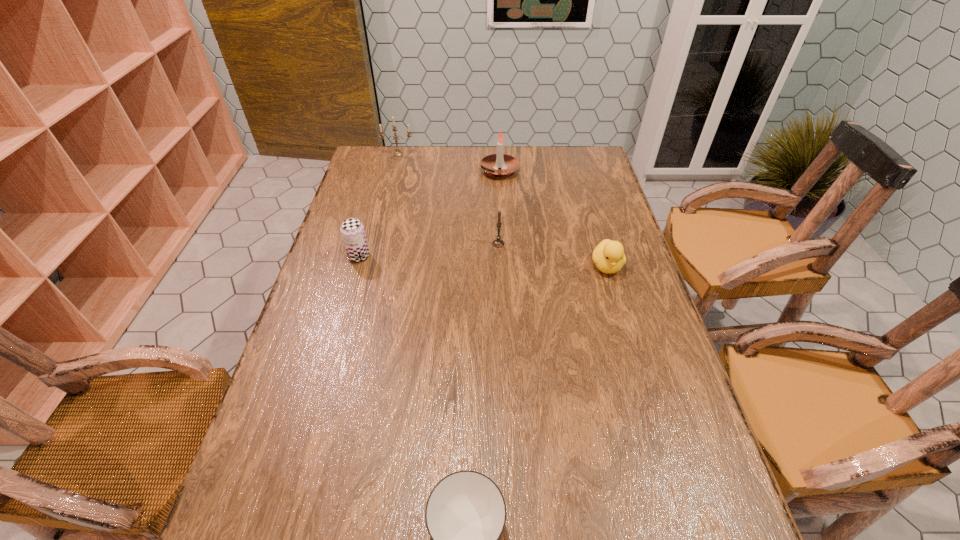
Find the location of a particular element. This screenshot has width=960, height=540. the second farthest object is located at coordinates (490, 164).

Where is `the farthest candle`? The image size is (960, 540). the farthest candle is located at coordinates (397, 153).

Locate an element on the screen. This screenshot has width=960, height=540. the leftmost candle is located at coordinates (397, 153).

The height and width of the screenshot is (540, 960). Find the location of `the third farthest object`. the third farthest object is located at coordinates (498, 243).

Locate an element on the screen. The height and width of the screenshot is (540, 960). the nearest candle is located at coordinates (498, 243).

This screenshot has height=540, width=960. I want to click on beer can, so click(x=352, y=230).

The image size is (960, 540). I want to click on the rightmost object, so click(x=608, y=256).

The height and width of the screenshot is (540, 960). In order to click on blank area located 0.330m on the left of the second nearest candle in this screenshot , I will do `click(392, 171)`.

Image resolution: width=960 pixels, height=540 pixels. What are the coordinates of `free space located 0.050m on the right of the leftmost candle` in the screenshot? It's located at (427, 154).

In order to click on vacant space located 0.390m on the back of the fourth nearest object in this screenshot , I will do `click(495, 172)`.